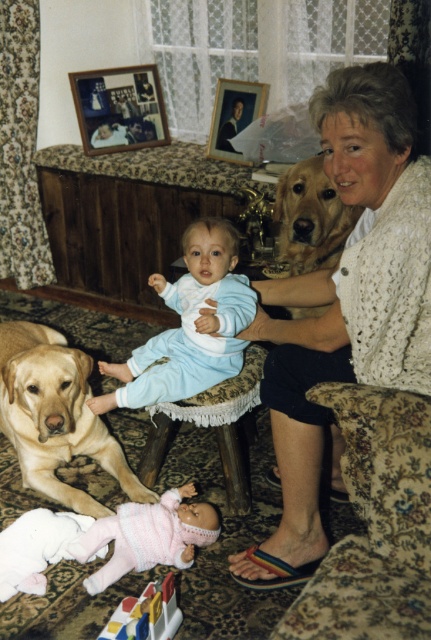
Does light blue soft fabric baby at center come in front of golden fur dog at upper right?

Yes, it is.

Is light blue soft fabric baby at center to the right of golden fur dog at upper right from the viewer's perspective?

In fact, light blue soft fabric baby at center is to the left of golden fur dog at upper right.

Who is more forward, (128,378) or (315,184)?

Point (315,184) is more forward.

This screenshot has height=640, width=431. What are the coordinates of `light blue soft fabric baby at center` in the screenshot? It's located at (190, 324).

Is knitted pink sweater at lower center taller than wooden photo frame at upper center?

No.

Is knitted pink sweater at lower center shorter than wooden photo frame at upper center?

Yes, knitted pink sweater at lower center is shorter than wooden photo frame at upper center.

Is point (169, 499) behind point (208, 140)?

No, it is in front of (208, 140).

Locate an element on the screen. This screenshot has height=640, width=431. knitted pink sweater at lower center is located at coordinates (147, 536).

Is floral fabric couch at lower center above woodenobject at upper center?

No.

Image resolution: width=431 pixels, height=640 pixels. Describe the element at coordinates (374, 524) in the screenshot. I see `floral fabric couch at lower center` at that location.

Where is `floral fabric couch at lower center`? floral fabric couch at lower center is located at coordinates (374, 524).